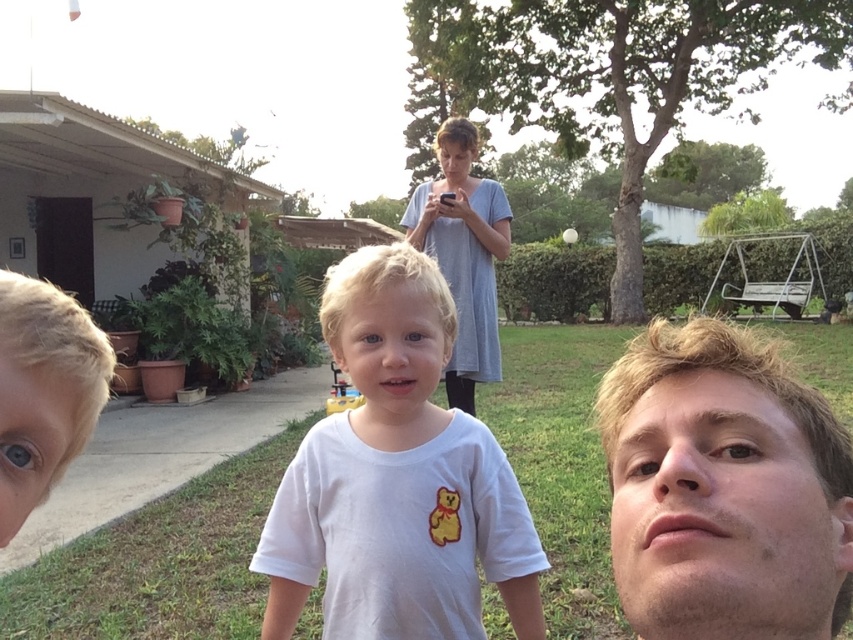
Question: Which point is closer to the camera?

Choices:
 (A) smooth skin face at lower right
 (B) gray fabric dress at upper center
 (C) blonde hair at left
 (D) white matte t-shirt at center

Answer: (A)

Question: Which of the following is the farthest from the observer?

Choices:
 (A) [358, 609]
 (B) [614, 444]

Answer: (A)

Question: Estimate the real-world distances between objects in this image. Which object is farther from the gray fabric dress at upper center?

Choices:
 (A) blonde hair at left
 (B) smooth skin face at lower right

Answer: (A)

Question: Is white matte t-shirt at center positioned behind gray fabric dress at upper center?

Choices:
 (A) yes
 (B) no

Answer: (B)

Question: In this image, where is white matte t-shirt at center located relative to smooth skin face at lower right?

Choices:
 (A) above
 (B) below

Answer: (B)

Question: Is white matte t-shirt at center bigger than blonde hair at left?

Choices:
 (A) yes
 (B) no

Answer: (A)